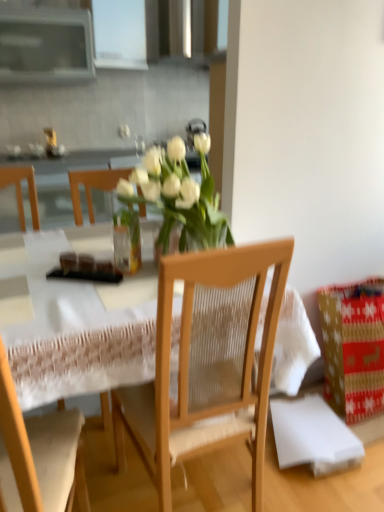
You are a GUI agent. You are given a task and a screenshot of the screen. Output one action in this format:
    pyautogui.click(x=<x>, y=<y>)
    Task: Click on the free space behind matte brown bread at table
    The height and width of the screenshot is (512, 384).
    Given the screenshot: What is the action you would take?
    pyautogui.click(x=89, y=247)